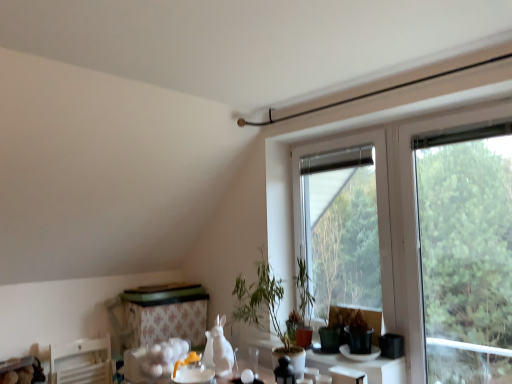
Question: Is the depth of green leafy tree at right less than that of transparent glass vase at lower center?

Choices:
 (A) yes
 (B) no

Answer: (A)

Question: Can you confirm if green leafy tree at right is taller than transparent glass vase at lower center?

Choices:
 (A) no
 (B) yes

Answer: (B)

Question: Can you confirm if green leafy tree at right is positioned to the right of transparent glass vase at lower center?

Choices:
 (A) no
 (B) yes

Answer: (B)

Question: Can we say green leafy tree at right lies outside transparent glass vase at lower center?

Choices:
 (A) yes
 (B) no

Answer: (A)

Question: Is transparent glass vase at lower center completely or partially inside green leafy tree at right?

Choices:
 (A) yes
 (B) no

Answer: (B)

Question: Does green leafy tree at right touch transparent glass vase at lower center?

Choices:
 (A) no
 (B) yes

Answer: (A)

Question: Is there a large distance between green leafy tree at right and transparent glass window at center?

Choices:
 (A) yes
 (B) no

Answer: (B)

Question: Considering the relative positions of green leafy tree at right and transparent glass window at center in the image provided, is green leafy tree at right to the left of transparent glass window at center from the viewer's perspective?

Choices:
 (A) yes
 (B) no

Answer: (B)

Question: Would you say green leafy tree at right is outside transparent glass window at center?

Choices:
 (A) yes
 (B) no

Answer: (A)

Question: Does green leafy tree at right have a smaller size compared to transparent glass window at center?

Choices:
 (A) yes
 (B) no

Answer: (B)

Question: Considering the relative positions of green leafy tree at right and transparent glass window at center in the image provided, is green leafy tree at right in front of transparent glass window at center?

Choices:
 (A) yes
 (B) no

Answer: (A)

Question: Can you see green leafy tree at right touching transparent glass window at center?

Choices:
 (A) no
 (B) yes

Answer: (A)

Question: From a real-world perspective, is green leafy tree at right physically below floral-patterned fabric at lower center?

Choices:
 (A) no
 (B) yes

Answer: (A)